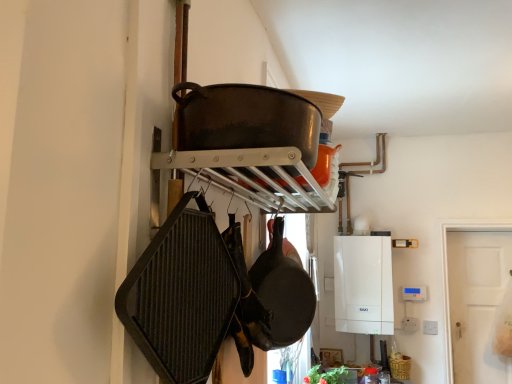
Question: Is point (173, 235) closer or farther from the camera than point (282, 233)?

Choices:
 (A) closer
 (B) farther

Answer: (A)

Question: In terms of width, does dark gray textured frying pan at left, which ranks as the 2th frying pan in right-to-left order, look wider or thinner when compared to black matte frying pan at center, the second frying pan when ordered from front to back?

Choices:
 (A) thin
 (B) wide

Answer: (A)

Question: Considering the real-world distances, which object is farthest from the dark gray textured frying pan at left, placed as the first frying pan when sorted from left to right?

Choices:
 (A) white plastic boiler at center
 (B) black matte frying pan at center, placed as the 1th frying pan when sorted from back to front
 (C) dark brown cast iron wok at upper center

Answer: (A)

Question: Estimate the real-world distances between objects in this image. Which object is farther from the black matte frying pan at center, placed as the 1th frying pan when sorted from back to front?

Choices:
 (A) white plastic boiler at center
 (B) dark gray textured frying pan at left, which is the first frying pan from front to back
 (C) dark brown cast iron wok at upper center

Answer: (A)